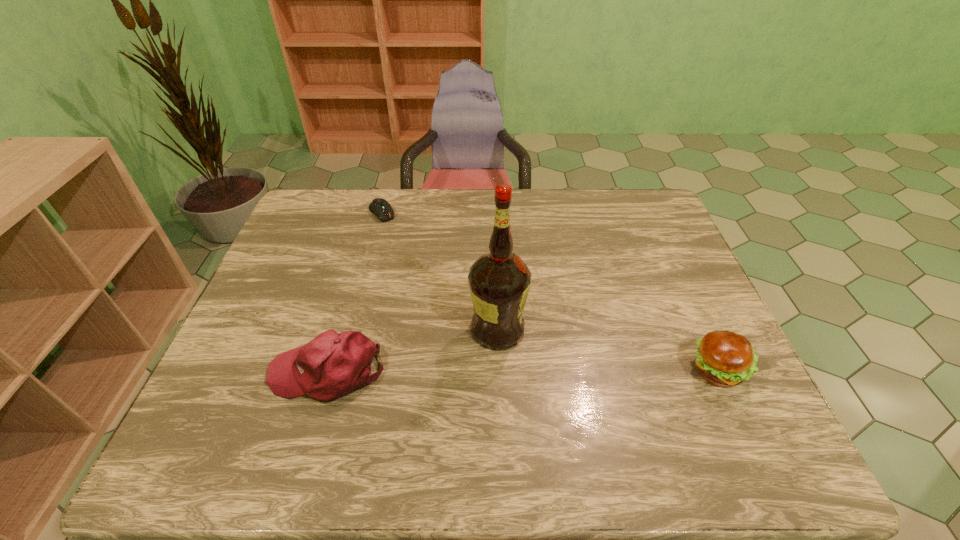
You are a GUI agent. You are given a task and a screenshot of the screen. Output one action in this format:
    pyautogui.click(x=<x>, y=<y>)
    Task: Click on the baseball cap
    This screenshot has height=540, width=960.
    Given the screenshot: What is the action you would take?
    pyautogui.click(x=332, y=365)

You are a GUI agent. You are given a task and a screenshot of the screen. Output one action in this format:
    pyautogui.click(x=<x>, y=<y>)
    Task: Click on the rightmost object
    The width and height of the screenshot is (960, 540).
    Given the screenshot: What is the action you would take?
    pyautogui.click(x=724, y=358)

Find the location of a particular element. Image resolution: width=960 pixels, height=540 pixels. the second shortest object is located at coordinates (724, 358).

In order to click on the farthest object in this screenshot , I will do pyautogui.click(x=380, y=207).

Where is `the shortest object`? The width and height of the screenshot is (960, 540). the shortest object is located at coordinates (380, 207).

Where is `alcohol`? The height and width of the screenshot is (540, 960). alcohol is located at coordinates (499, 282).

Locate an element on the screen. The image size is (960, 540). the tallest object is located at coordinates (499, 282).

The width and height of the screenshot is (960, 540). I want to click on free space located on the left of the rightmost object, so click(x=575, y=372).

Find the location of a particular element. The image size is (960, 540). free location located 0.310m on the button of the shortest object is located at coordinates (429, 278).

The width and height of the screenshot is (960, 540). Identify the location of free space located 0.330m on the button of the shortest object. (432, 282).